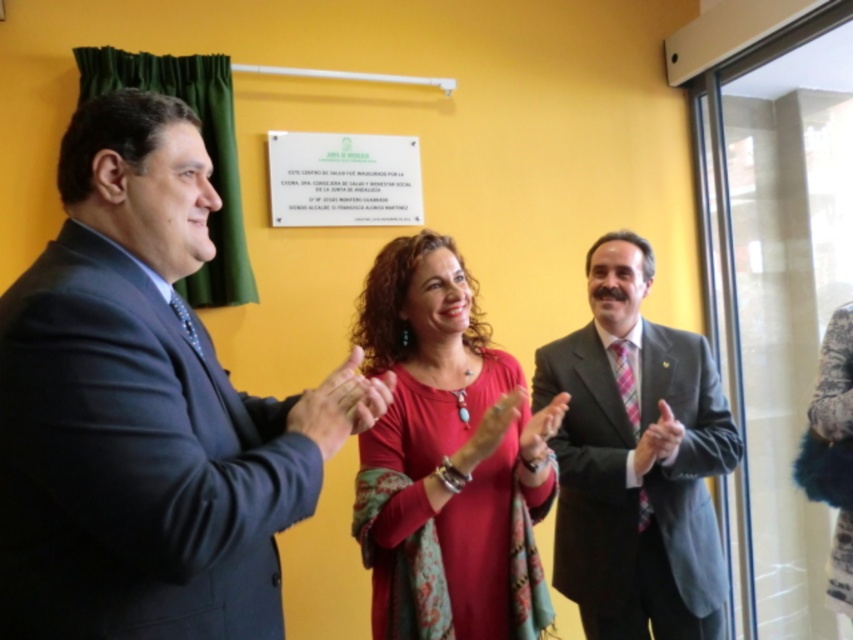
Can you confirm if fuzzy gray coat at center is positioned below smooth black suit at center?

Yes, fuzzy gray coat at center is below smooth black suit at center.

Is fuzzy gray coat at center positioned before smooth black suit at center?

No, it is behind smooth black suit at center.

Is point (831, 390) more distant than point (659, 433)?

That is True.

Find the location of a particular element. The width and height of the screenshot is (853, 640). fuzzy gray coat at center is located at coordinates (833, 380).

Measure the distance between matte red blouse at center and camera.

matte red blouse at center and camera are 4.48 feet apart.

Who is more distant from viewer, (389, 314) or (670, 438)?

The point (670, 438) is behind.

The width and height of the screenshot is (853, 640). I want to click on matte red blouse at center, so click(x=442, y=451).

Is matte black suit at left positioned in front of fuzzy gray coat at center?

Yes, matte black suit at left is closer to the viewer.

Can you confirm if matte black suit at left is positioned to the right of fuzzy gray coat at center?

No, matte black suit at left is not to the right of fuzzy gray coat at center.

Which is behind, point (299, 504) or point (836, 611)?

Positioned behind is point (836, 611).

I want to click on matte black suit at left, so click(144, 408).